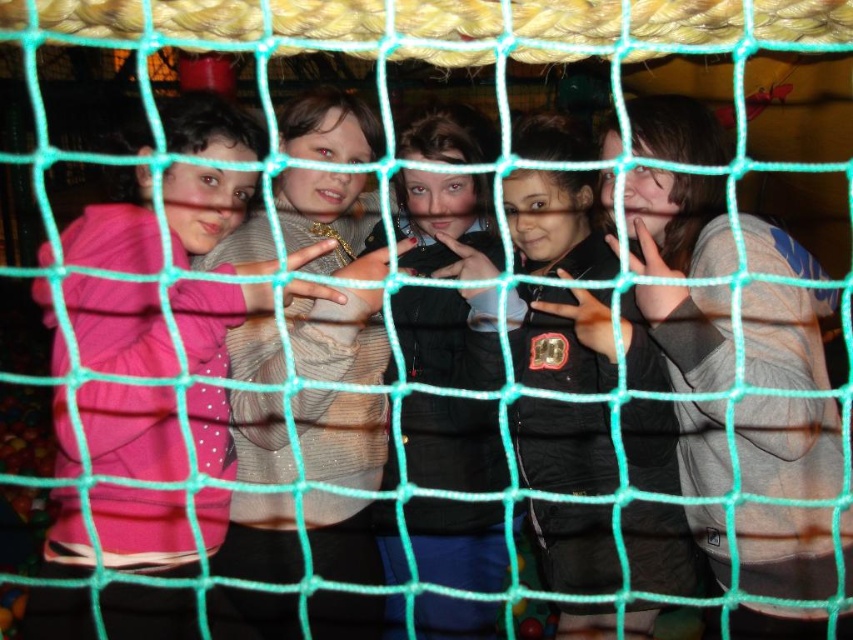
Question: Among these objects, which one is farthest from the camera?

Choices:
 (A) black leather jacket at center
 (B) pink matte jacket at left

Answer: (A)

Question: Considering the relative positions of dark gray jacket at center and black leather jacket at center in the image provided, where is dark gray jacket at center located with respect to black leather jacket at center?

Choices:
 (A) above
 (B) below

Answer: (A)

Question: Is dark gray jacket at center positioned at the back of black leather jacket at center?

Choices:
 (A) yes
 (B) no

Answer: (B)

Question: Which point is farther to the camera?

Choices:
 (A) (636, 458)
 (B) (675, 198)

Answer: (B)

Question: Is pink matte jacket at left wider than dark gray jacket at center?

Choices:
 (A) yes
 (B) no

Answer: (A)

Question: Which of these objects is positioned closest to the light beige sweater at center?

Choices:
 (A) dark gray jacket at center
 (B) pink matte jacket at left

Answer: (B)